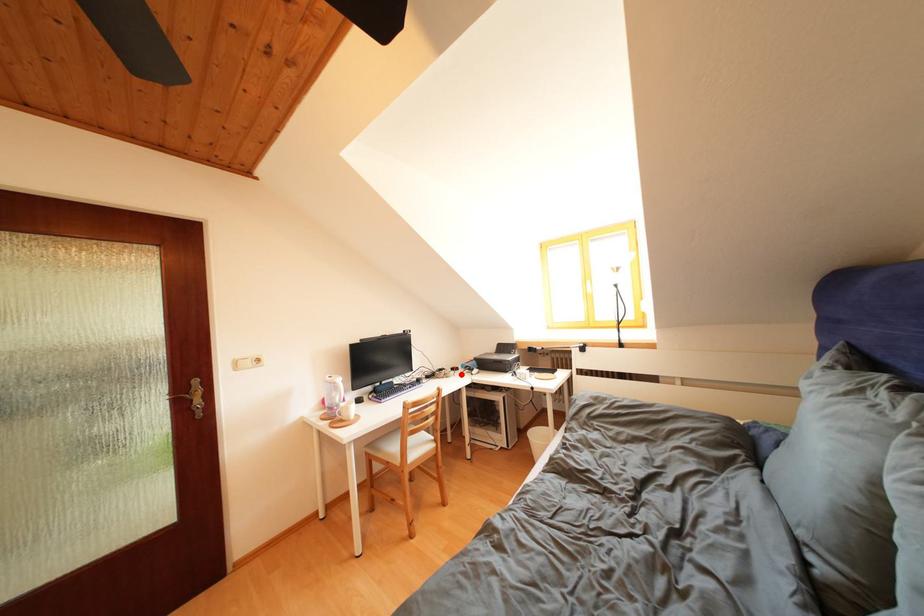
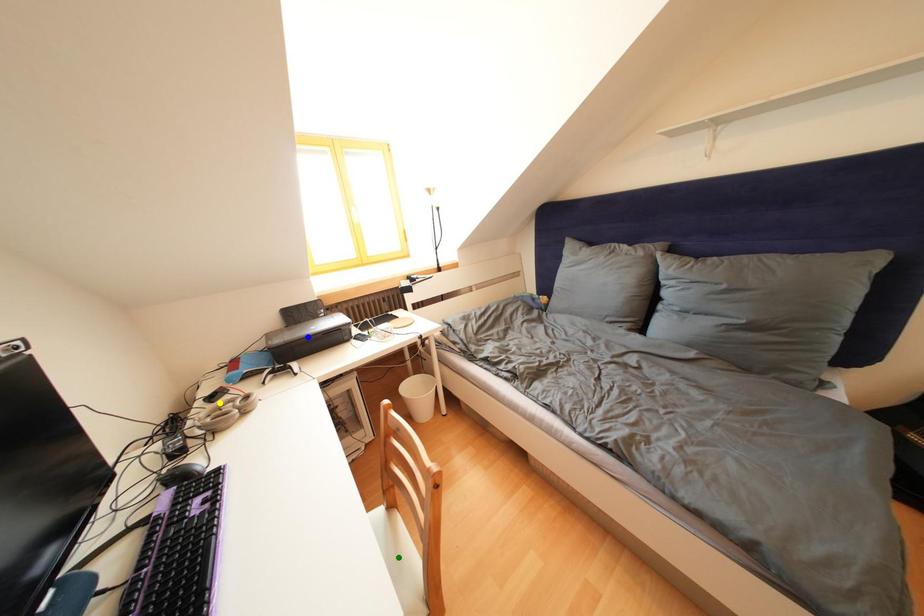
Question: I am providing you with two images of the same scene from different viewpoints. A red point is marked on the first image. You are given multiple points on the second image. In image 2, which mark is for the same physical point as the one in image 1?

Choices:
 (A) green point
 (B) yellow point
 (C) blue point

Answer: (B)